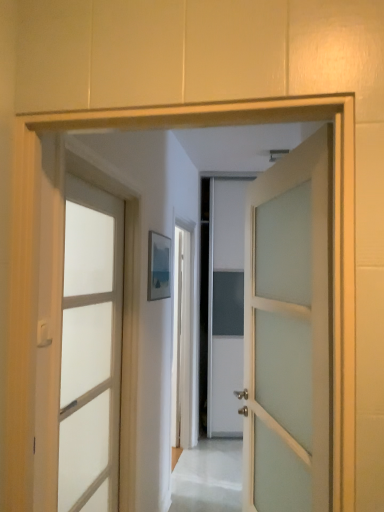
Question: From the image's perspective, would you say matte white door handle at left is shown under white frosted glass door at center, the second door viewed from the left?

Choices:
 (A) no
 (B) yes

Answer: (A)

Question: Does matte white door handle at left have a greater width compared to white frosted glass door at center, the second door viewed from the left?

Choices:
 (A) no
 (B) yes

Answer: (A)

Question: From the image's perspective, is matte white door handle at left located above white frosted glass door at center, the second door viewed from the left?

Choices:
 (A) yes
 (B) no

Answer: (A)

Question: Would you consider matte white door handle at left to be distant from white frosted glass door at center, the second door viewed from the left?

Choices:
 (A) no
 (B) yes

Answer: (A)

Question: Is matte white door handle at left in front of white frosted glass door at center, which is the 1th door in right-to-left order?

Choices:
 (A) yes
 (B) no

Answer: (B)

Question: In terms of size, does matte white door handle at left appear bigger or smaller than translucent glass door at center, the 1th door from the left?

Choices:
 (A) big
 (B) small

Answer: (B)

Question: Is matte white door handle at left to the left or to the right of translucent glass door at center, the 1th door from the left, in the image?

Choices:
 (A) right
 (B) left

Answer: (B)

Question: Choose the correct answer: Is matte white door handle at left inside translucent glass door at center, which is the second door in right-to-left order, or outside it?

Choices:
 (A) inside
 (B) outside

Answer: (B)

Question: In terms of width, does matte white door handle at left look wider or thinner when compared to translucent glass door at center, which is the second door in right-to-left order?

Choices:
 (A) wide
 (B) thin

Answer: (B)

Question: Considering the positions of matte white door handle at left and white frosted glass door at center, which is the 1th door in right-to-left order, in the image, is matte white door handle at left bigger or smaller than white frosted glass door at center, which is the 1th door in right-to-left order,?

Choices:
 (A) big
 (B) small

Answer: (B)

Question: Relative to white frosted glass door at center, which is the 1th door in right-to-left order, is matte white door handle at left in front or behind?

Choices:
 (A) behind
 (B) front

Answer: (A)

Question: From the image's perspective, is matte white door handle at left above or below white frosted glass door at center, which is the 1th door in right-to-left order?

Choices:
 (A) above
 (B) below

Answer: (A)

Question: Looking at their shapes, would you say matte white door handle at left is wider or thinner than white frosted glass door at center, which is the 1th door in right-to-left order?

Choices:
 (A) wide
 (B) thin

Answer: (B)

Question: From a real-world perspective, relative to white frosted glass door at center, which is the 1th door in right-to-left order, is translucent glass door at center, which is the second door in right-to-left order, vertically above or below?

Choices:
 (A) above
 (B) below

Answer: (B)

Question: From their relative heights in the image, would you say translucent glass door at center, the 1th door from the left, is taller or shorter than white frosted glass door at center, which is the 1th door in right-to-left order?

Choices:
 (A) short
 (B) tall

Answer: (B)